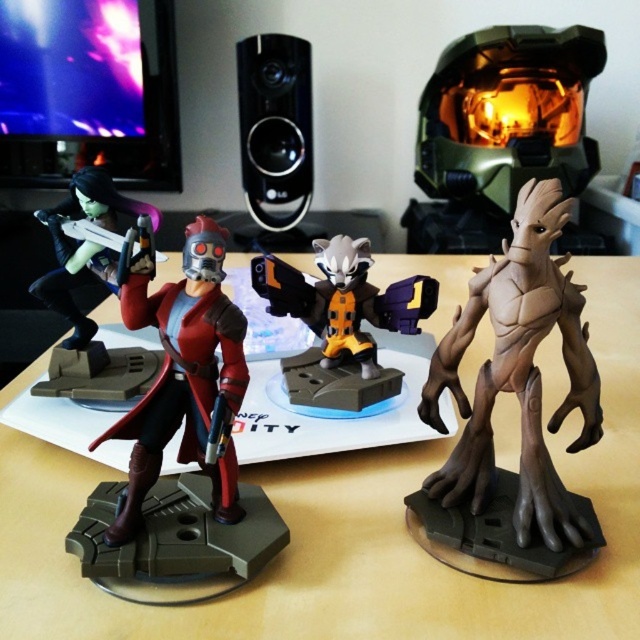
You are placing a small vase that is 5 inches in diameter on the light brown wood table at center. The matte black figure at left is nearby. Will the vase fit between the table and the figure without touching either?

The light brown wood table at center is 16.67 inches away from the matte black figure at left. Since the vase is only 5 inches in diameter, there is sufficient space between them to place the vase without it touching either object.